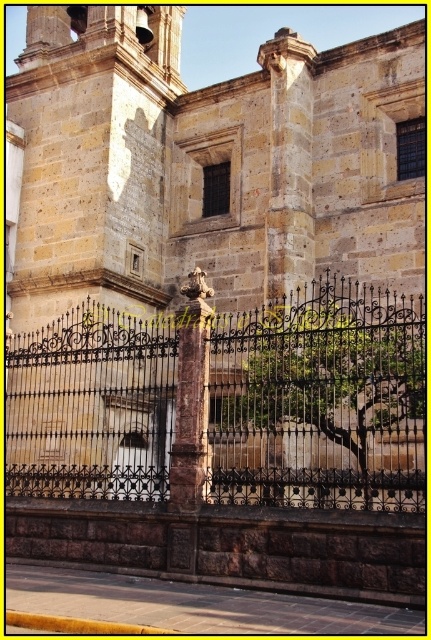
Question: Does iron/blackened metal fence at center appear under green leafy tree at center?

Choices:
 (A) yes
 (B) no

Answer: (A)

Question: Does iron/blackened metal fence at center have a lesser width compared to green leafy tree at center?

Choices:
 (A) no
 (B) yes

Answer: (A)

Question: Can you confirm if iron/blackened metal fence at center is thinner than green leafy tree at center?

Choices:
 (A) no
 (B) yes

Answer: (A)

Question: Which point is closer to the camera?

Choices:
 (A) green leafy tree at center
 (B) iron/blackened metal fence at center

Answer: (A)

Question: Which object is closer to the camera taking this photo?

Choices:
 (A) green leafy tree at center
 (B) iron/blackened metal fence at center

Answer: (A)